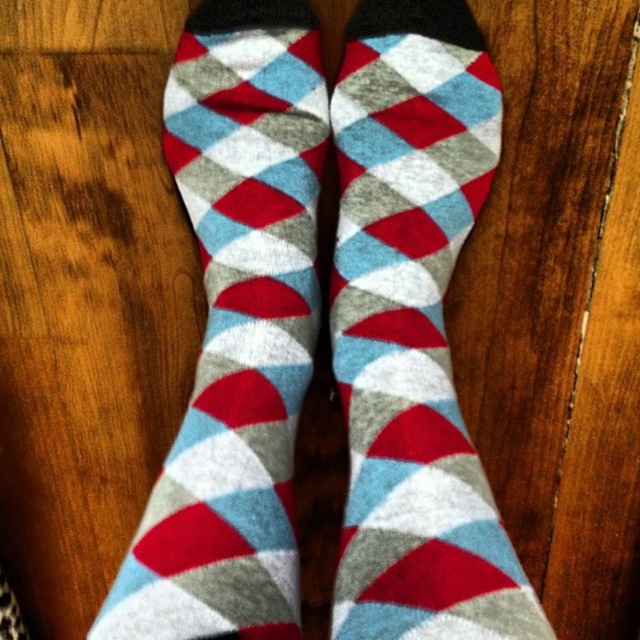
Question: Does argyle wool socks at center appear over argyle-patterned wool sock at center?

Choices:
 (A) yes
 (B) no

Answer: (A)

Question: Can you confirm if argyle wool socks at center is positioned to the left of argyle-patterned wool sock at center?

Choices:
 (A) yes
 (B) no

Answer: (B)

Question: Which point is closer to the camera taking this photo?

Choices:
 (A) (406, 449)
 (B) (253, 228)

Answer: (A)

Question: Is argyle wool socks at center to the right of argyle-patterned wool sock at center from the viewer's perspective?

Choices:
 (A) no
 (B) yes

Answer: (B)

Question: Which of the following is the farthest from the observer?

Choices:
 (A) argyle-patterned wool sock at center
 (B) argyle wool socks at center

Answer: (A)